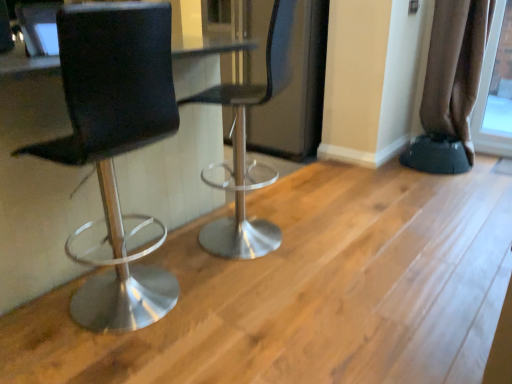
Question: Is transparent glass screen door at center not close to metallic silver stool at center, the 2th chair from the left?

Choices:
 (A) no
 (B) yes

Answer: (A)

Question: Can you confirm if transparent glass screen door at center is shorter than metallic silver stool at center, the 2th chair from the left?

Choices:
 (A) yes
 (B) no

Answer: (B)

Question: Does transparent glass screen door at center have a larger size compared to metallic silver stool at center, which is the first chair from right to left?

Choices:
 (A) no
 (B) yes

Answer: (B)

Question: Could you tell me if transparent glass screen door at center is turned towards metallic silver stool at center, the 2th chair from the left?

Choices:
 (A) yes
 (B) no

Answer: (A)

Question: Is transparent glass screen door at center next to metallic silver stool at center, which is the first chair from right to left?

Choices:
 (A) yes
 (B) no

Answer: (B)

Question: In terms of height, does brown fabric curtain at right look taller or shorter compared to metallic silver stool at center, which is the first chair from right to left?

Choices:
 (A) short
 (B) tall

Answer: (A)

Question: From the image's perspective, is brown fabric curtain at right located above or below metallic silver stool at center, the 2th chair from the left?

Choices:
 (A) above
 (B) below

Answer: (A)

Question: From a real-world perspective, is brown fabric curtain at right physically located above or below metallic silver stool at center, which is the first chair from right to left?

Choices:
 (A) above
 (B) below

Answer: (A)

Question: Considering their positions, is brown fabric curtain at right located in front of or behind metallic silver stool at center, which is the first chair from right to left?

Choices:
 (A) behind
 (B) front

Answer: (A)

Question: Is transparent glass screen door at center inside or outside of black rubber step stool at lower right?

Choices:
 (A) outside
 (B) inside

Answer: (A)

Question: Is transparent glass screen door at center to the left or to the right of black rubber step stool at lower right in the image?

Choices:
 (A) left
 (B) right

Answer: (A)

Question: Is transparent glass screen door at center wider or thinner than black rubber step stool at lower right?

Choices:
 (A) thin
 (B) wide

Answer: (B)

Question: From the image's perspective, is transparent glass screen door at center above or below black rubber step stool at lower right?

Choices:
 (A) above
 (B) below

Answer: (A)

Question: Is point (262, 185) closer or farther from the camera than point (315, 110)?

Choices:
 (A) farther
 (B) closer

Answer: (B)

Question: Based on their sizes in the image, would you say metallic silver stool at center, the 2th chair from the left, is bigger or smaller than transparent glass screen door at center?

Choices:
 (A) small
 (B) big

Answer: (A)